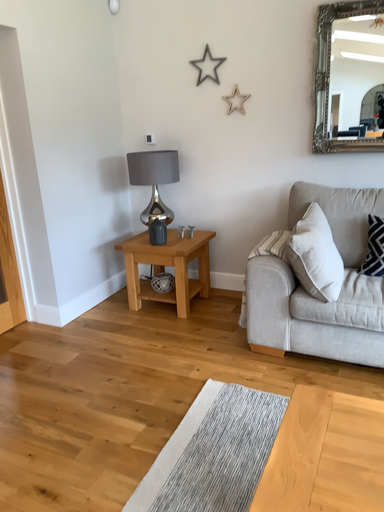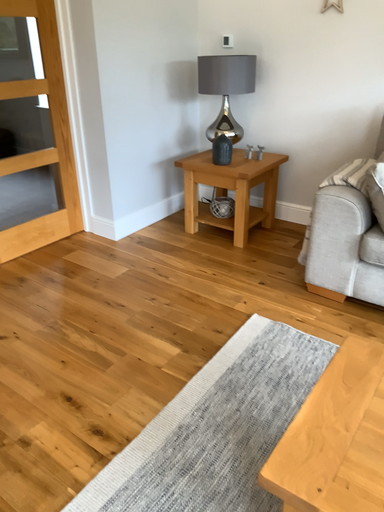
Question: Which way did the camera rotate in the video?

Choices:
 (A) rotated upward
 (B) rotated downward

Answer: (B)